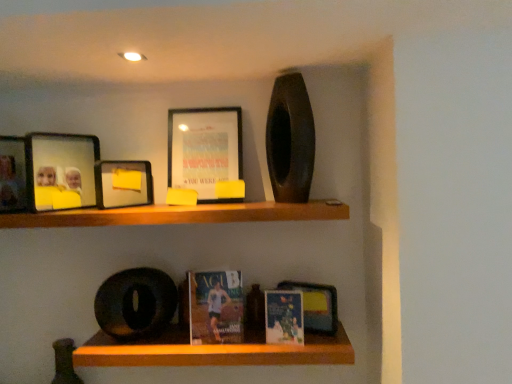
Question: Is matte black picture frame at upper left, which is the first picture frame from left to right, inside the boundaries of matte paper book at center, the second paperback book when ordered from left to right, or outside?

Choices:
 (A) inside
 (B) outside

Answer: (B)

Question: Is matte black picture frame at upper left, which is the first picture frame from left to right, in front of or behind matte paper book at center, acting as the first paperback book starting from the right, in the image?

Choices:
 (A) front
 (B) behind

Answer: (A)

Question: Which object is positioned farthest from the matte glass photo frame at upper left, positioned as the 3th picture frame in right-to-left order?

Choices:
 (A) matte paper book at center
 (B) matte paperback book at center, the first paperback book from the left
 (C) matte black picture frame at upper center, the 1th picture frame viewed from the right
 (D) matte black picture frame at upper left, which is the first picture frame from left to right
 (E) matte plastic picture frame at upper left, the second picture frame viewed from the right

Answer: (A)

Question: Which of these objects is positioned farthest from the wooden shelf at upper center, arranged as the first shelf when viewed from the top?

Choices:
 (A) matte paper book at center
 (B) matte paperback book at center, the first paperback book from the left
 (C) matte black picture frame at upper left, marked as the 4th picture frame in a right-to-left arrangement
 (D) matte paper book at center, the second paperback book when ordered from left to right
 (E) matte glass photo frame at upper left, positioned as the 3th picture frame in right-to-left order

Answer: (A)